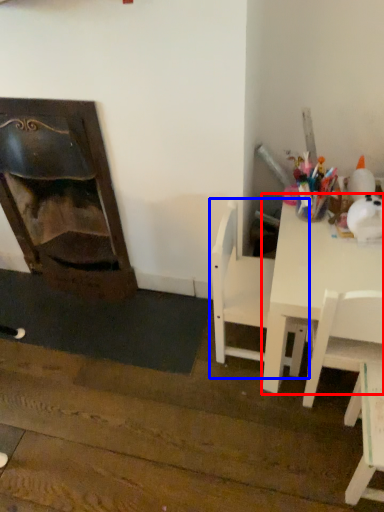
Question: Among these objects, which one is nearest to the camera, table (highlighted by a red box) or chair (highlighted by a blue box)?

Choices:
 (A) table
 (B) chair

Answer: (A)